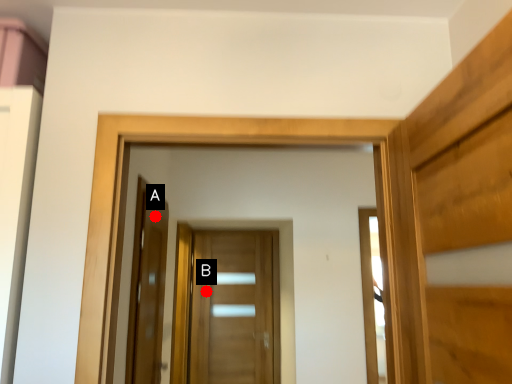
Question: Two points are circled on the image, labeled by A and B beside each circle. Among these points, which one is farthest from the camera?

Choices:
 (A) A is further
 (B) B is further

Answer: (B)